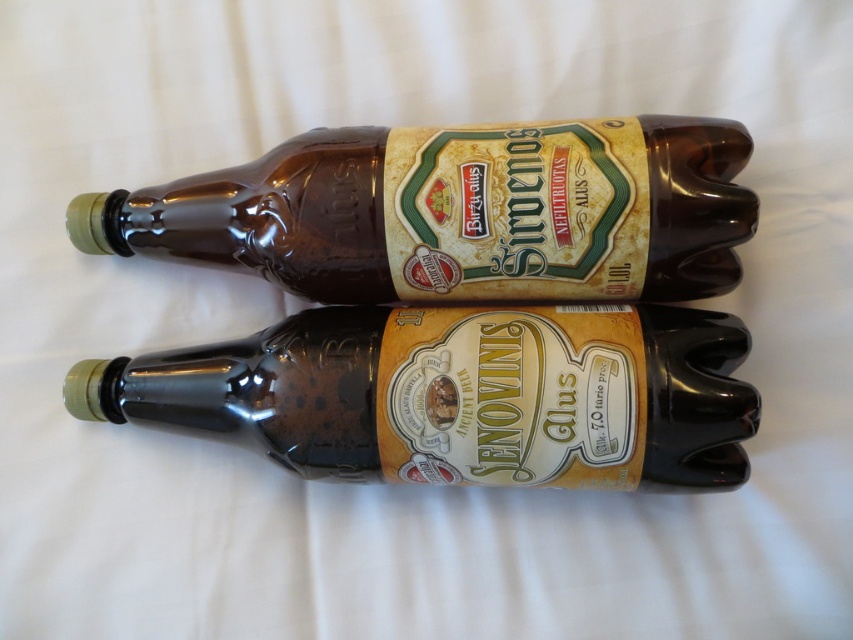
Is shiny brown glass bottle at center further to camera compared to brown glass bottle at center?

Yes, it is behind brown glass bottle at center.

You are a GUI agent. You are given a task and a screenshot of the screen. Output one action in this format:
    pyautogui.click(x=<x>, y=<y>)
    Task: Click on the shiny brown glass bottle at center
    
    Given the screenshot: What is the action you would take?
    pyautogui.click(x=460, y=394)